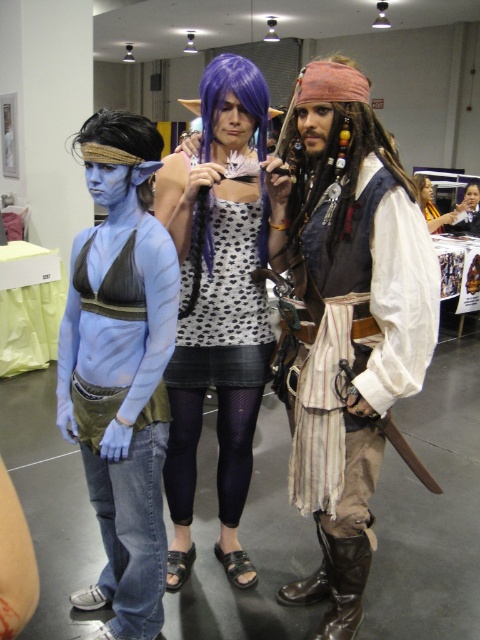
Question: Is leather vest at center below purple synthetic wig at center?

Choices:
 (A) yes
 (B) no

Answer: (A)

Question: Which point is farther to the camera?

Choices:
 (A) (127, 172)
 (B) (457, 221)
 (C) (267, 198)
 (D) (375, 141)

Answer: (B)

Question: Which object is positioned farthest from the polka dot fabric dress at center?

Choices:
 (A) matte black dress at center
 (B) leather vest at center
 (C) blue matte hair at center
 (D) blue matte skin at center

Answer: (A)

Question: Can you confirm if polka dot fabric dress at center is positioned to the left of matte purple wig at center?

Choices:
 (A) yes
 (B) no

Answer: (A)

Question: Among these points, which one is nearest to the camera?

Choices:
 (A) (456, 205)
 (B) (440, 230)

Answer: (B)

Question: Can you confirm if leather vest at center is thinner than matte purple wig at center?

Choices:
 (A) no
 (B) yes

Answer: (A)